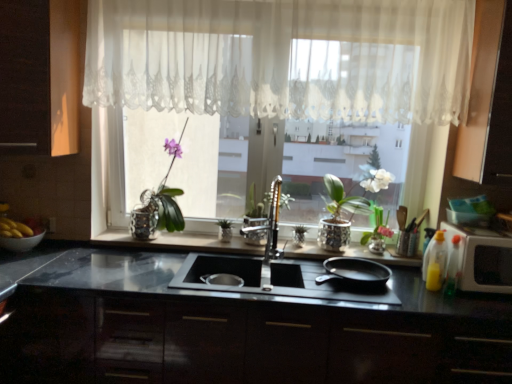
The width and height of the screenshot is (512, 384). In order to click on unoccupied region to the right of yellow translucent bottle at right, the 1th bottle positioned from the right in this screenshot , I will do point(485,299).